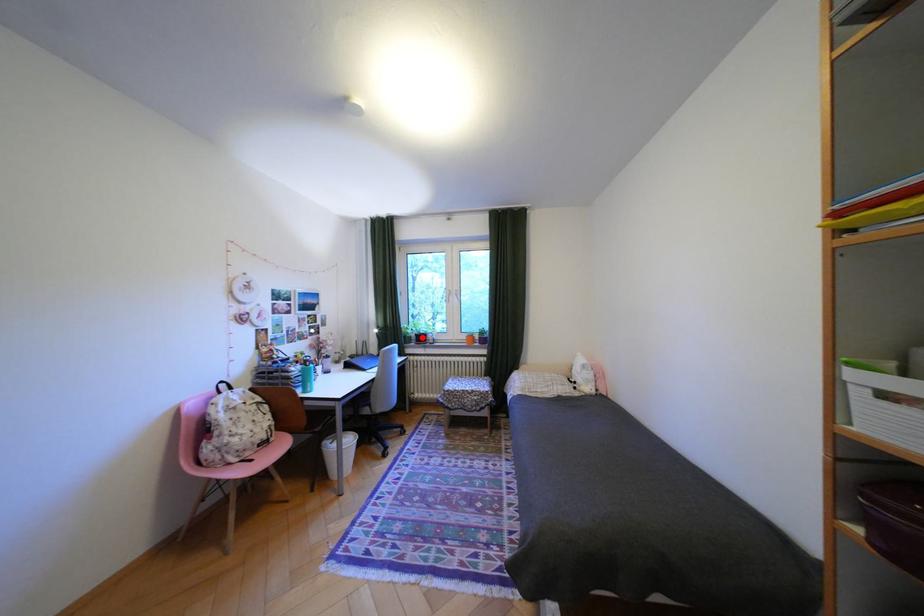
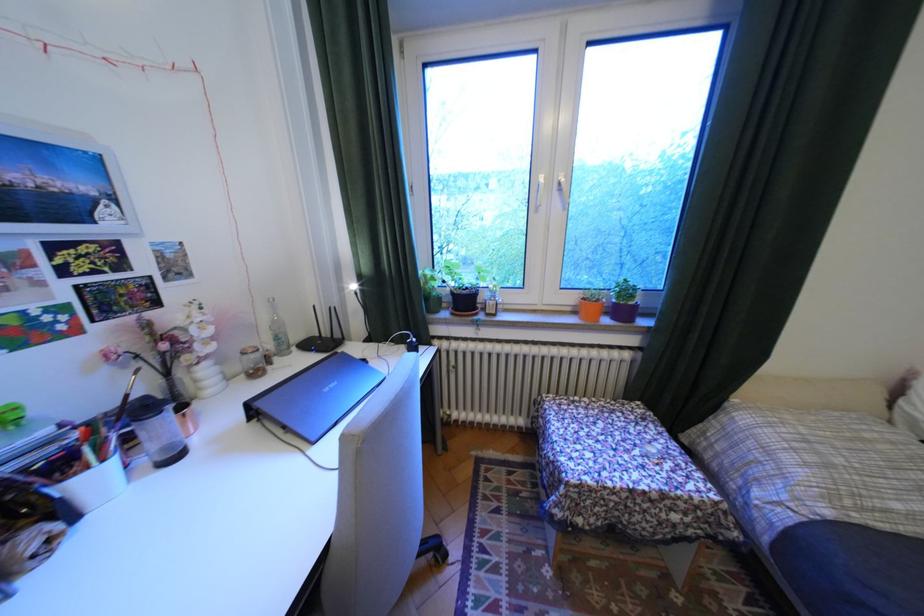
Locate, in the second image, the point that corresponds to the highlighted location in the first image.

(451, 299)